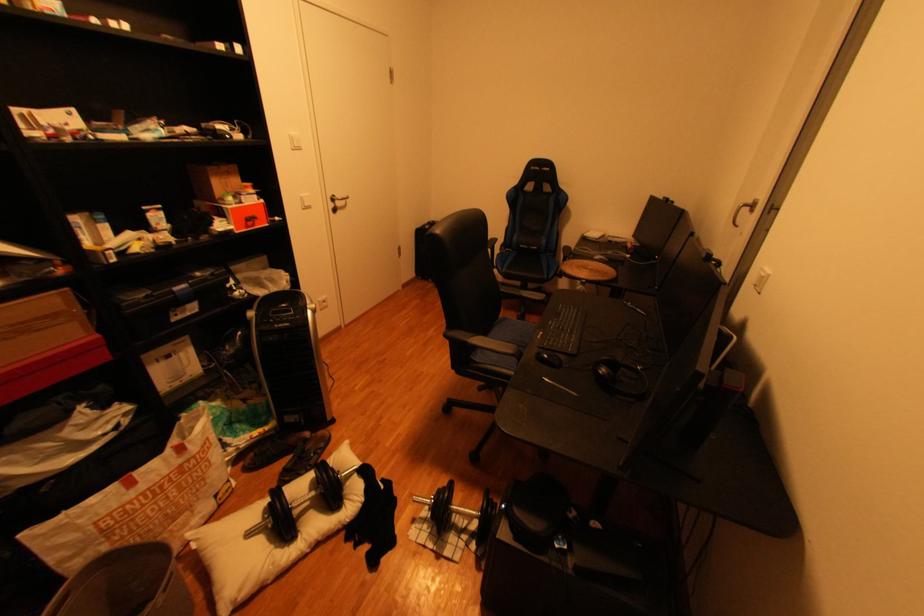
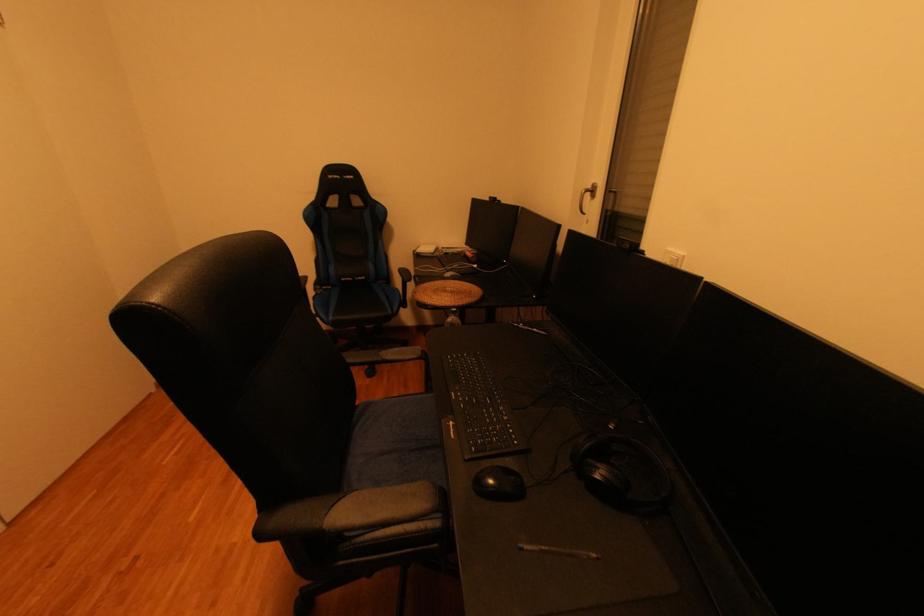
Question: The camera is either moving clockwise (left) or counter-clockwise (right) around the object. The first image is from the beginning of the video and the second image is from the end. Is the camera moving left or right when shooting the video?

Choices:
 (A) Left
 (B) Right

Answer: (A)